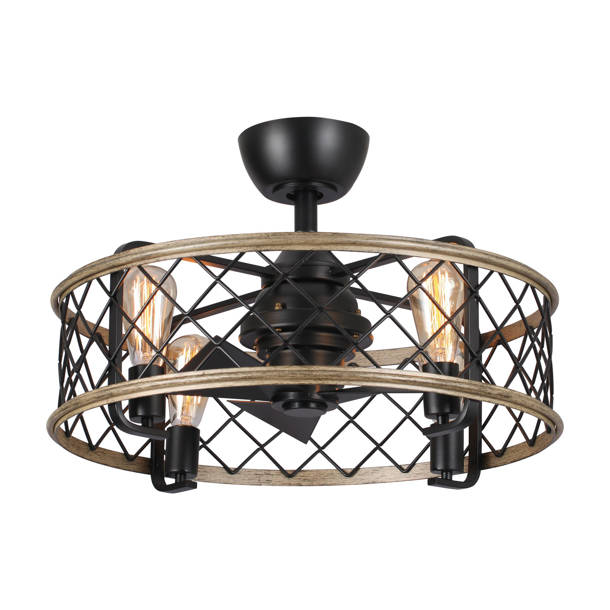
Where is `light bulbs`? The image size is (610, 610). light bulbs is located at coordinates (143, 295), (185, 402), (440, 312), (461, 356).